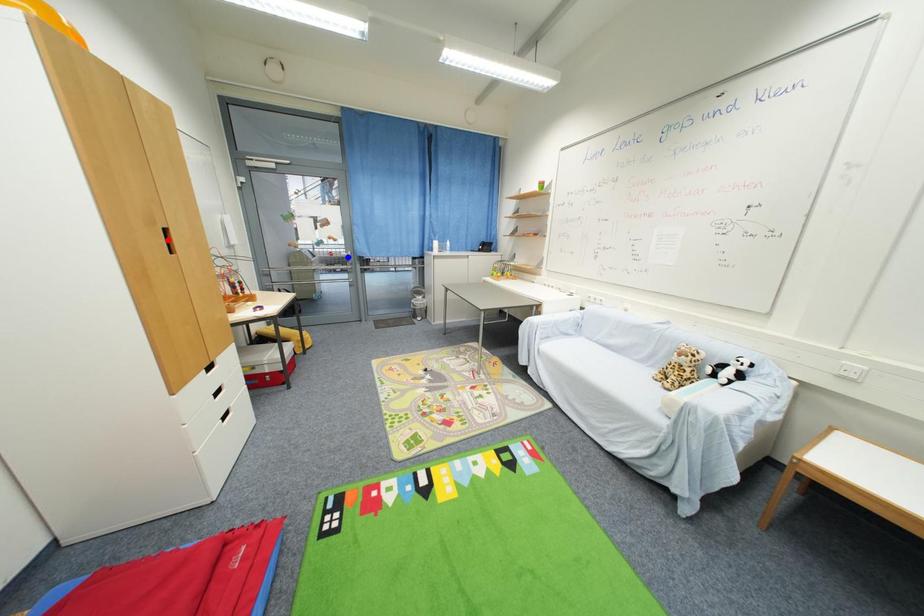
Question: Which of the two points in the image is closer to the camera?

Choices:
 (A) Blue point is closer.
 (B) Red point is closer.

Answer: (B)